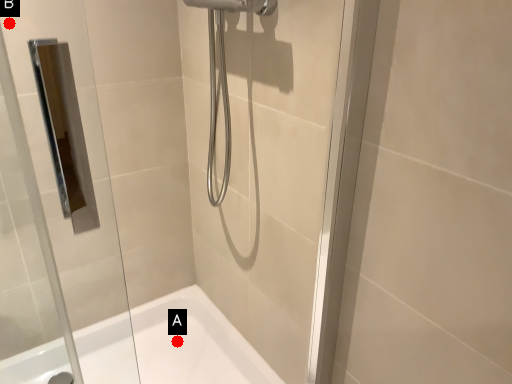
Question: Two points are circled on the image, labeled by A and B beside each circle. Which point appears closest to the camera in this image?

Choices:
 (A) A is closer
 (B) B is closer

Answer: (B)